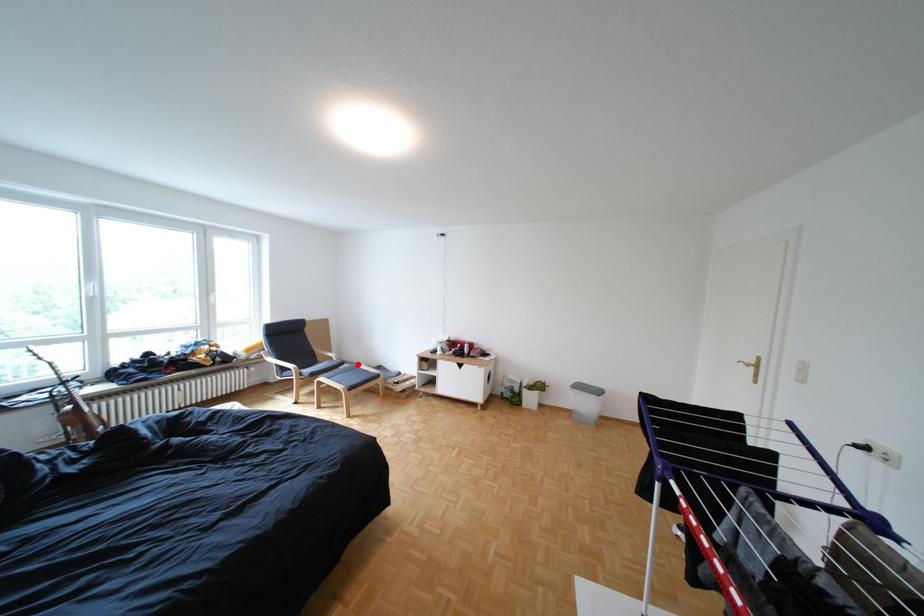
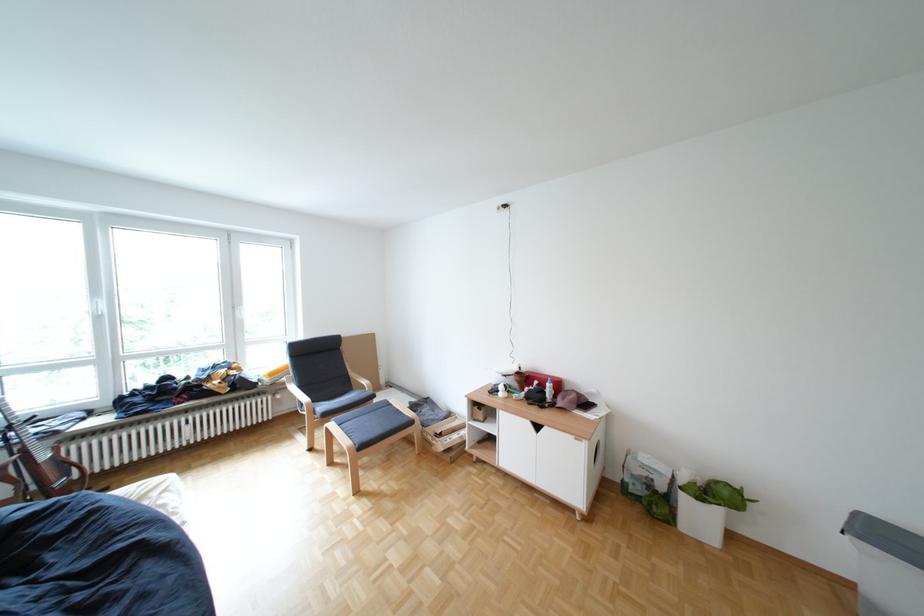
Find the pixel in the second image that matches the highlighted location in the first image.

(388, 397)